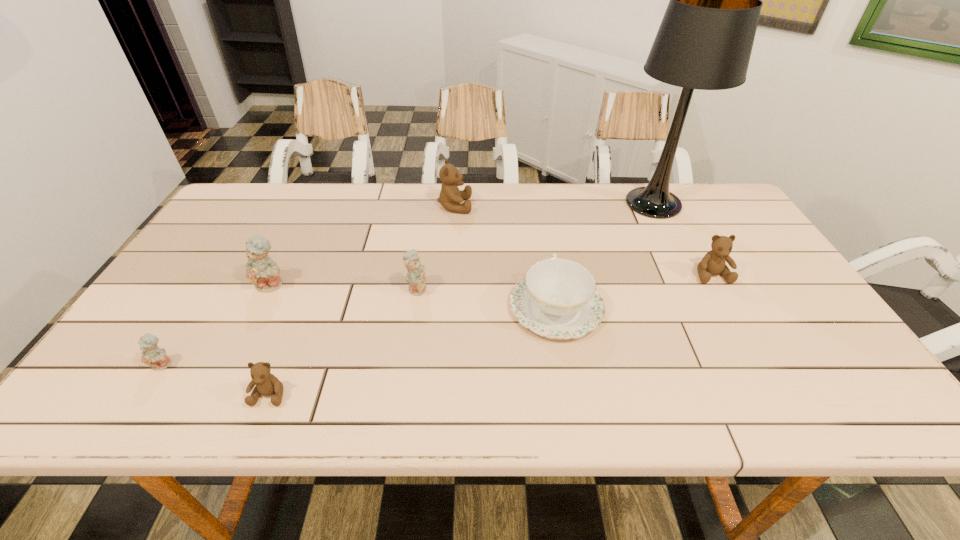
Where is `free space located 0.330m on the handle side of the sixth object from left to right`? Image resolution: width=960 pixels, height=540 pixels. free space located 0.330m on the handle side of the sixth object from left to right is located at coordinates (539, 206).

Locate an element on the screen. This screenshot has width=960, height=540. free space located 0.330m on the handle side of the sixth object from left to right is located at coordinates (539, 206).

This screenshot has width=960, height=540. I want to click on vacant position located on the handle side of the sixth object from left to right, so click(x=537, y=194).

In order to click on vacant space located on the front-facing side of the leftmost object in this screenshot , I will do `click(146, 393)`.

I want to click on table lamp located in the far edge section of the desktop, so click(x=705, y=39).

The height and width of the screenshot is (540, 960). I want to click on teddy bear that is at the far edge, so click(x=450, y=197).

Identify the location of object that is positioned at the near edge. (267, 384).

Find the location of a particular element. This screenshot has width=960, height=540. object that is at the left edge is located at coordinates (152, 355).

This screenshot has width=960, height=540. In order to click on table lamp that is at the right edge in this screenshot , I will do `click(705, 39)`.

Find the location of a particular element. Image resolution: width=960 pixels, height=540 pixels. teddy bear that is at the right edge is located at coordinates (713, 263).